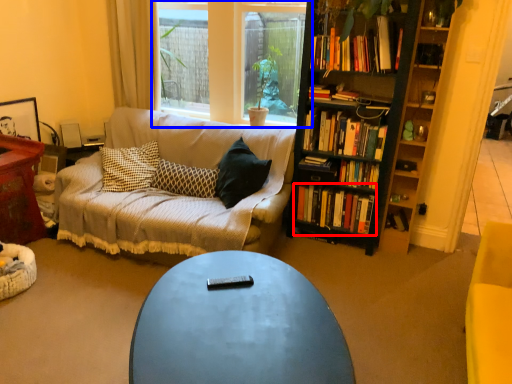
Question: Among these objects, which one is nearest to the camera, book (highlighted by a red box) or window (highlighted by a blue box)?

Choices:
 (A) book
 (B) window

Answer: (B)